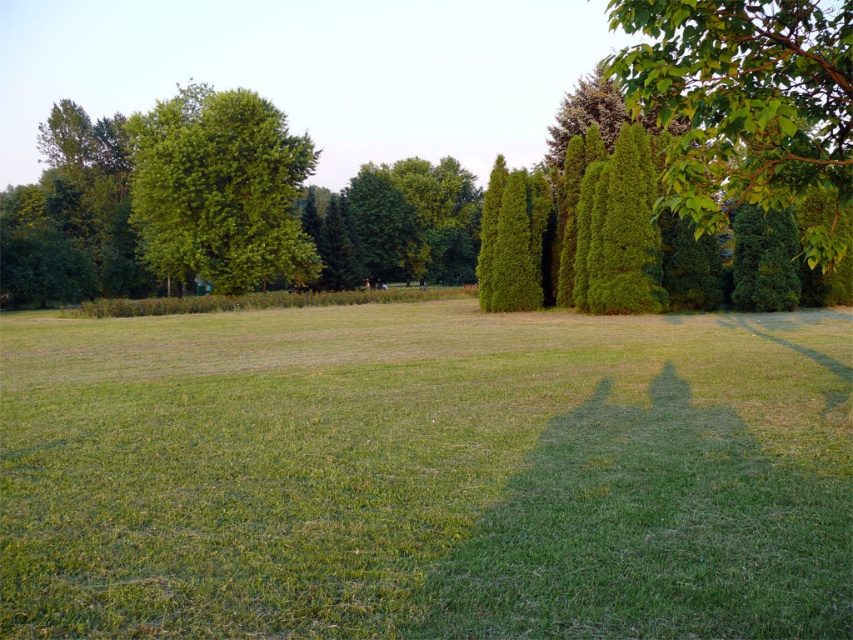
You are standing at the point marked by the coordinates point (x=746, y=104) in the park. Looking around, you see a green leafy tree at upper right. Which direction should you walk to reach the nearest grassy field area?

The point (x=746, y=104) is located at the green leafy tree at upper right. To reach the nearest grassy field area, you should walk towards the lower part of the image where the grassy field is situated.